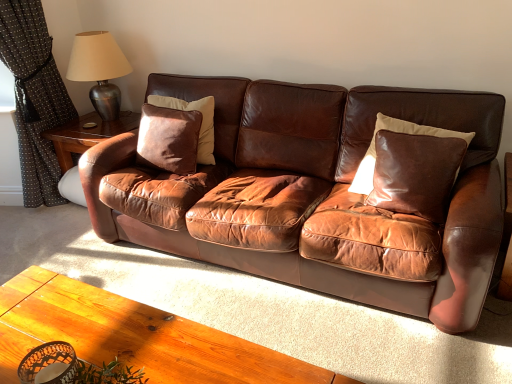
The image size is (512, 384). Describe the element at coordinates (396, 132) in the screenshot. I see `shiny brown leather pillow at right, acting as the first pillow starting from the right` at that location.

Measure the distance between point (332, 128) and camera.

Point (332, 128) and camera are 2.44 meters apart.

Identify the location of metallic silver table lamp at upper left. (99, 70).

Measure the distance between black dotted fabric at left and camera.

The distance of black dotted fabric at left from camera is 2.60 meters.

In order to face suede-like brown pillow at center-left, acting as the 1th pillow starting from the left, should I rotate leftwards or rightwards?

Rotate left and turn 11.551 degrees.

You are a GUI agent. You are given a task and a screenshot of the screen. Output one action in this format:
    pyautogui.click(x=<x>, y=<y>)
    Task: Click on the shiny brown leather pillow at right, which ranks as the 2th pillow in left-to-right order
    The width and height of the screenshot is (512, 384).
    Given the screenshot: What is the action you would take?
    pyautogui.click(x=396, y=132)

Does brown leather couch at center turn towards suede-like brown pillow at center-left, which is the 2th pillow in right-to-left order?

Yes, brown leather couch at center is oriented towards suede-like brown pillow at center-left, which is the 2th pillow in right-to-left order.

Can you confirm if brown leather couch at center is bigger than suede-like brown pillow at center-left, acting as the 1th pillow starting from the left?

Yes, brown leather couch at center is bigger than suede-like brown pillow at center-left, acting as the 1th pillow starting from the left.

Where is `studio couch in front of the suede-like brown pillow at center-left, acting as the 1th pillow starting from the left`? This screenshot has height=384, width=512. studio couch in front of the suede-like brown pillow at center-left, acting as the 1th pillow starting from the left is located at coordinates (311, 195).

Is the depth of brown leather couch at center less than that of suede-like brown pillow at center-left, which is the 2th pillow in right-to-left order?

Yes.

Is metallic silver table lamp at upper left positioned far away from shiny brown leather pillow at right, acting as the first pillow starting from the right?

Yes.

Is metallic silver table lamp at upper left looking in the opposite direction of shiny brown leather pillow at right, acting as the first pillow starting from the right?

No, metallic silver table lamp at upper left's orientation is not away from shiny brown leather pillow at right, acting as the first pillow starting from the right.

Which is correct: metallic silver table lamp at upper left is inside shiny brown leather pillow at right, which ranks as the 2th pillow in left-to-right order, or outside of it?

metallic silver table lamp at upper left lies outside shiny brown leather pillow at right, which ranks as the 2th pillow in left-to-right order.

Is metallic silver table lamp at upper left to the left or to the right of shiny brown leather pillow at right, acting as the first pillow starting from the right, in the image?

From the image, it's evident that metallic silver table lamp at upper left is to the left of shiny brown leather pillow at right, acting as the first pillow starting from the right.

Between point (362, 167) and point (92, 34), which one is positioned in front?

Positioned in front is point (362, 167).

Is shiny brown leather pillow at right, acting as the first pillow starting from the right, completely or partially outside of metallic silver table lamp at upper left?

Absolutely, shiny brown leather pillow at right, acting as the first pillow starting from the right, is external to metallic silver table lamp at upper left.

From the image's perspective, is shiny brown leather pillow at right, acting as the first pillow starting from the right, under metallic silver table lamp at upper left?

Yes, from the image's perspective, shiny brown leather pillow at right, acting as the first pillow starting from the right, is beneath metallic silver table lamp at upper left.

Considering the relative sizes of brown leather couch at center and black dotted fabric at left in the image provided, is brown leather couch at center shorter than black dotted fabric at left?

Indeed, brown leather couch at center has a lesser height compared to black dotted fabric at left.

Consider the image. Measure the distance between brown leather couch at center and black dotted fabric at left.

They are 1.45 meters apart.

Relative to black dotted fabric at left, is brown leather couch at center in front or behind?

brown leather couch at center is in front of black dotted fabric at left.

From the image's perspective, which is below, brown leather couch at center or black dotted fabric at left?

brown leather couch at center, from the image's perspective.

Identify the location of pillow behind the shiny brown leather pillow at right, which ranks as the 2th pillow in left-to-right order. This screenshot has width=512, height=384. (201, 123).

From a real-world perspective, between shiny brown leather pillow at right, acting as the first pillow starting from the right, and suede-like brown pillow at center-left, acting as the 1th pillow starting from the left, who is vertically higher?

From a 3D spatial view, suede-like brown pillow at center-left, acting as the 1th pillow starting from the left, is above.

From the picture: Considering the positions of objects shiny brown leather pillow at right, which ranks as the 2th pillow in left-to-right order, and suede-like brown pillow at center-left, acting as the 1th pillow starting from the left, in the image provided, who is behind, shiny brown leather pillow at right, which ranks as the 2th pillow in left-to-right order, or suede-like brown pillow at center-left, acting as the 1th pillow starting from the left,?

suede-like brown pillow at center-left, acting as the 1th pillow starting from the left.

Between shiny brown leather pillow at right, which ranks as the 2th pillow in left-to-right order, and suede-like brown pillow at center-left, acting as the 1th pillow starting from the left, which one has smaller size?

Smaller between the two is suede-like brown pillow at center-left, acting as the 1th pillow starting from the left.

Is brown leather couch at center at the right side of metallic silver table lamp at upper left?

Correct, you'll find brown leather couch at center to the right of metallic silver table lamp at upper left.

Would you say brown leather couch at center is outside metallic silver table lamp at upper left?

Absolutely, brown leather couch at center is external to metallic silver table lamp at upper left.

Measure the distance from brown leather couch at center to metallic silver table lamp at upper left.

The distance of brown leather couch at center from metallic silver table lamp at upper left is 1.14 meters.

From the image's perspective, is brown leather couch at center beneath metallic silver table lamp at upper left?

Yes, from the image's perspective, brown leather couch at center is below metallic silver table lamp at upper left.

Do you think suede-like brown pillow at center-left, acting as the 1th pillow starting from the left, is within black dotted fabric at left, or outside of it?

suede-like brown pillow at center-left, acting as the 1th pillow starting from the left, is not inside black dotted fabric at left, it's outside.

Looking at this image, is suede-like brown pillow at center-left, acting as the 1th pillow starting from the left, facing away from black dotted fabric at left?

That's not correct — suede-like brown pillow at center-left, acting as the 1th pillow starting from the left, is not looking away from black dotted fabric at left.

Is suede-like brown pillow at center-left, acting as the 1th pillow starting from the left, placed right next to black dotted fabric at left?

suede-like brown pillow at center-left, acting as the 1th pillow starting from the left, and black dotted fabric at left are clearly separated.

In the image, is suede-like brown pillow at center-left, which is the 2th pillow in right-to-left order, positioned in front of or behind black dotted fabric at left?

suede-like brown pillow at center-left, which is the 2th pillow in right-to-left order, is positioned closer to the viewer than black dotted fabric at left.

You are a GUI agent. You are given a task and a screenshot of the screen. Output one action in this format:
    pyautogui.click(x=<x>, y=<y>)
    Task: Click on the studio couch below the suede-like brown pillow at center-left, acting as the 1th pillow starting from the left (from the image's perspective)
    
    Given the screenshot: What is the action you would take?
    pyautogui.click(x=311, y=195)

Identify the location of table lamp behind the shiny brown leather pillow at right, which ranks as the 2th pillow in left-to-right order. This screenshot has width=512, height=384. (99, 70).

Estimate the real-world distances between objects in this image. Which object is further from metallic silver table lamp at upper left, suede-like brown pillow at center-left, which is the 2th pillow in right-to-left order, or brown leather couch at center?

brown leather couch at center is further to metallic silver table lamp at upper left.

Consider the image. Which object lies nearer to the anchor point metallic silver table lamp at upper left, suede-like brown pillow at center-left, which is the 2th pillow in right-to-left order, or black dotted fabric at left?

Based on the image, black dotted fabric at left appears to be nearer to metallic silver table lamp at upper left.

When comparing their distances from metallic silver table lamp at upper left, does shiny brown leather pillow at right, which ranks as the 2th pillow in left-to-right order, or black dotted fabric at left seem further?

The object further to metallic silver table lamp at upper left is shiny brown leather pillow at right, which ranks as the 2th pillow in left-to-right order.

Looking at the image, which one is located closer to brown leather couch at center, suede-like brown pillow at center-left, which is the 2th pillow in right-to-left order, or shiny brown leather pillow at right, which ranks as the 2th pillow in left-to-right order?

shiny brown leather pillow at right, which ranks as the 2th pillow in left-to-right order, lies closer to brown leather couch at center than the other object.

Looking at the image, which one is located further to shiny brown leather pillow at right, acting as the first pillow starting from the right, suede-like brown pillow at center-left, acting as the 1th pillow starting from the left, or brown leather couch at center?

suede-like brown pillow at center-left, acting as the 1th pillow starting from the left, is positioned further to the anchor shiny brown leather pillow at right, acting as the first pillow starting from the right.

Based on their spatial positions, is metallic silver table lamp at upper left or black dotted fabric at left further from suede-like brown pillow at center-left, acting as the 1th pillow starting from the left?

Among the two, black dotted fabric at left is located further to suede-like brown pillow at center-left, acting as the 1th pillow starting from the left.

When comparing their distances from shiny brown leather pillow at right, acting as the first pillow starting from the right, does metallic silver table lamp at upper left or brown leather couch at center seem closer?

brown leather couch at center lies closer to shiny brown leather pillow at right, acting as the first pillow starting from the right, than the other object.

Considering their positions, is suede-like brown pillow at center-left, acting as the 1th pillow starting from the left, positioned closer to brown leather couch at center than black dotted fabric at left?

suede-like brown pillow at center-left, acting as the 1th pillow starting from the left, lies closer to brown leather couch at center than the other object.

Find the location of a particular element. The height and width of the screenshot is (384, 512). studio couch situated between black dotted fabric at left and shiny brown leather pillow at right, which ranks as the 2th pillow in left-to-right order, from left to right is located at coordinates point(311,195).

This screenshot has height=384, width=512. I want to click on pillow situated between metallic silver table lamp at upper left and shiny brown leather pillow at right, which ranks as the 2th pillow in left-to-right order, from left to right, so click(x=201, y=123).

Find the location of a particular element. This screenshot has width=512, height=384. table lamp between black dotted fabric at left and suede-like brown pillow at center-left, acting as the 1th pillow starting from the left, from left to right is located at coordinates (99, 70).

Find the location of `table lamp between black dotted fabric at left and shiny brown leather pillow at right, which ranks as the 2th pillow in left-to-right order, from left to right`. table lamp between black dotted fabric at left and shiny brown leather pillow at right, which ranks as the 2th pillow in left-to-right order, from left to right is located at coordinates (99, 70).